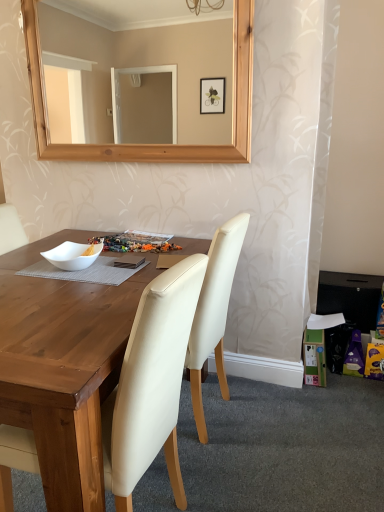
The width and height of the screenshot is (384, 512). Describe the element at coordinates (151, 384) in the screenshot. I see `cream leather chair at center, which is counted as the first chair, starting from the front` at that location.

Image resolution: width=384 pixels, height=512 pixels. What do you see at coordinates (73, 255) in the screenshot?
I see `white matte bowl at center` at bounding box center [73, 255].

Find the location of a particular element. The height and width of the screenshot is (512, 384). cream leather chair at center, arranged as the 2th chair when viewed from the back is located at coordinates (151, 384).

Looking at their sizes, would you say cream leather chair at center, the first chair viewed from the back, is wider or thinner than cream leather chair at center, which is counted as the first chair, starting from the front?

Clearly, cream leather chair at center, the first chair viewed from the back, has more width compared to cream leather chair at center, which is counted as the first chair, starting from the front.

The height and width of the screenshot is (512, 384). What are the coordinates of `chair in front of the cream leather chair at center, the first chair viewed from the back` in the screenshot? It's located at (151, 384).

Is cream leather chair at center, the first chair viewed from the back, facing towards cream leather chair at center, arranged as the 2th chair when viewed from the back?

No, cream leather chair at center, the first chair viewed from the back, does not turn towards cream leather chair at center, arranged as the 2th chair when viewed from the back.

Considering their positions, is cream leather chair at center, the second chair viewed from the front, located in front of or behind cream leather chair at center, arranged as the 2th chair when viewed from the back?

Visually, cream leather chair at center, the second chair viewed from the front, is located behind cream leather chair at center, arranged as the 2th chair when viewed from the back.

Which of these two, cream leather chair at center, which is counted as the first chair, starting from the front, or white matte bowl at center, is smaller?

white matte bowl at center.

Is point (139, 440) positioned before point (56, 249)?

Yes.

Is cream leather chair at center, arranged as the 2th chair when viewed from the back, not inside white matte bowl at center?

Absolutely, cream leather chair at center, arranged as the 2th chair when viewed from the back, is external to white matte bowl at center.

How many degrees apart are the facing directions of cream leather chair at center, arranged as the 2th chair when viewed from the back, and white matte bowl at center?

The angle between the facing direction of cream leather chair at center, arranged as the 2th chair when viewed from the back, and the facing direction of white matte bowl at center is 96.1 degrees.

In terms of width, does white matte bowl at center look wider or thinner when compared to cream leather chair at center, the second chair viewed from the front?

Considering their sizes, white matte bowl at center looks slimmer than cream leather chair at center, the second chair viewed from the front.

In terms of size, does white matte bowl at center appear bigger or smaller than cream leather chair at center, the first chair viewed from the back?

Clearly, white matte bowl at center is smaller in size than cream leather chair at center, the first chair viewed from the back.

Locate an element on the screen. Image resolution: width=384 pixels, height=512 pixels. bowl on the left of cream leather chair at center, the first chair viewed from the back is located at coordinates (73, 255).

From a real-world perspective, which object stands above the other?

From a 3D spatial view, white matte bowl at center is above.

Consider the image. Would you say white matte bowl at center is inside or outside cream leather chair at center, which is counted as the first chair, starting from the front?

white matte bowl at center is spatially situated outside cream leather chair at center, which is counted as the first chair, starting from the front.

Which of these two, white matte bowl at center or cream leather chair at center, which is counted as the first chair, starting from the front, is bigger?

cream leather chair at center, which is counted as the first chair, starting from the front, is bigger.

Which is more distant, (48, 261) or (149, 398)?

The point (48, 261) is behind.

Is cream leather chair at center, the first chair viewed from the back, facing towards white matte bowl at center?

No, cream leather chair at center, the first chair viewed from the back, does not turn towards white matte bowl at center.

From the image's perspective, is cream leather chair at center, the second chair viewed from the front, above or below white matte bowl at center?

Clearly, from the image's perspective, cream leather chair at center, the second chair viewed from the front, is below white matte bowl at center.

Looking at this image, is cream leather chair at center, the second chair viewed from the front, to the left of white matte bowl at center from the viewer's perspective?

No, cream leather chair at center, the second chair viewed from the front, is not to the left of white matte bowl at center.

Is the surface of cream leather chair at center, the first chair viewed from the back, in direct contact with white matte bowl at center?

No, cream leather chair at center, the first chair viewed from the back, is not touching white matte bowl at center.

Considering the sizes of objects cream leather chair at center, which is counted as the first chair, starting from the front, and cream leather chair at center, the first chair viewed from the back, in the image provided, who is bigger, cream leather chair at center, which is counted as the first chair, starting from the front, or cream leather chair at center, the first chair viewed from the back,?

With larger size is cream leather chair at center, which is counted as the first chair, starting from the front.

Which object is more forward, cream leather chair at center, arranged as the 2th chair when viewed from the back, or cream leather chair at center, the first chair viewed from the back?

cream leather chair at center, arranged as the 2th chair when viewed from the back, is in front.

In the scene shown: Is cream leather chair at center, the second chair viewed from the front, a part of cream leather chair at center, arranged as the 2th chair when viewed from the back?

Definitely not — cream leather chair at center, the second chair viewed from the front, is not inside cream leather chair at center, arranged as the 2th chair when viewed from the back.

This screenshot has height=512, width=384. I want to click on chair that appears above the cream leather chair at center, the second chair viewed from the front (from a real-world perspective), so click(151, 384).

Find the location of a particular element. Image resolution: width=384 pixels, height=512 pixels. bowl above the cream leather chair at center, arranged as the 2th chair when viewed from the back (from the image's perspective) is located at coordinates (73, 255).

Which object lies nearer to the anchor point white matte bowl at center, cream leather chair at center, which is counted as the first chair, starting from the front, or cream leather chair at center, the second chair viewed from the front?

cream leather chair at center, the second chair viewed from the front.

Which object lies nearer to the anchor point cream leather chair at center, the first chair viewed from the back, cream leather chair at center, which is counted as the first chair, starting from the front, or white matte bowl at center?

cream leather chair at center, which is counted as the first chair, starting from the front, is closer to cream leather chair at center, the first chair viewed from the back.

Based on their spatial positions, is cream leather chair at center, the first chair viewed from the back, or white matte bowl at center closer to cream leather chair at center, which is counted as the first chair, starting from the front?

cream leather chair at center, the first chair viewed from the back, is closer to cream leather chair at center, which is counted as the first chair, starting from the front.

Considering their positions, is white matte bowl at center positioned further to cream leather chair at center, which is counted as the first chair, starting from the front, than cream leather chair at center, the first chair viewed from the back?

white matte bowl at center.

Based on their spatial positions, is white matte bowl at center or cream leather chair at center, arranged as the 2th chair when viewed from the back, closer to cream leather chair at center, the second chair viewed from the front?

Based on the image, cream leather chair at center, arranged as the 2th chair when viewed from the back, appears to be nearer to cream leather chair at center, the second chair viewed from the front.

When comparing their distances from white matte bowl at center, does cream leather chair at center, the first chair viewed from the back, or cream leather chair at center, which is counted as the first chair, starting from the front, seem further?

Among the two, cream leather chair at center, which is counted as the first chair, starting from the front, is located further to white matte bowl at center.

Identify the location of chair positioned between cream leather chair at center, which is counted as the first chair, starting from the front, and white matte bowl at center from near to far. The width and height of the screenshot is (384, 512). (214, 312).